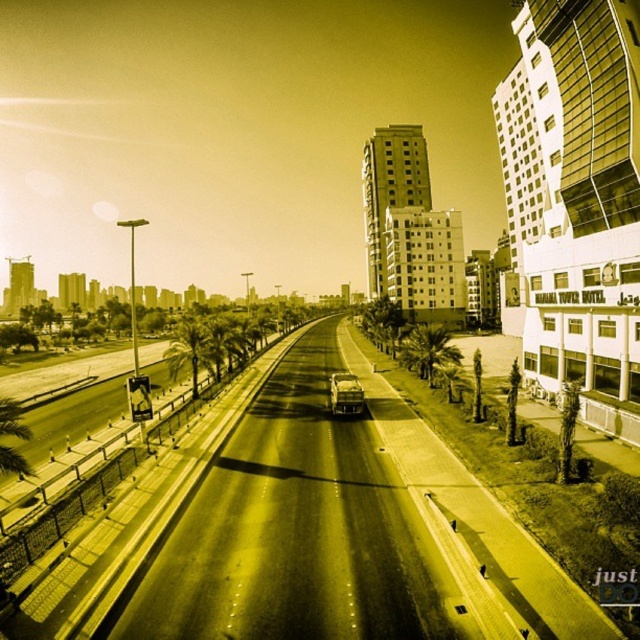
You are standing at the point marked by the coordinates point (426, 349) in the image. What object is located at this point?

The point (426, 349) marks the location of the green leafy palm tree at center right.